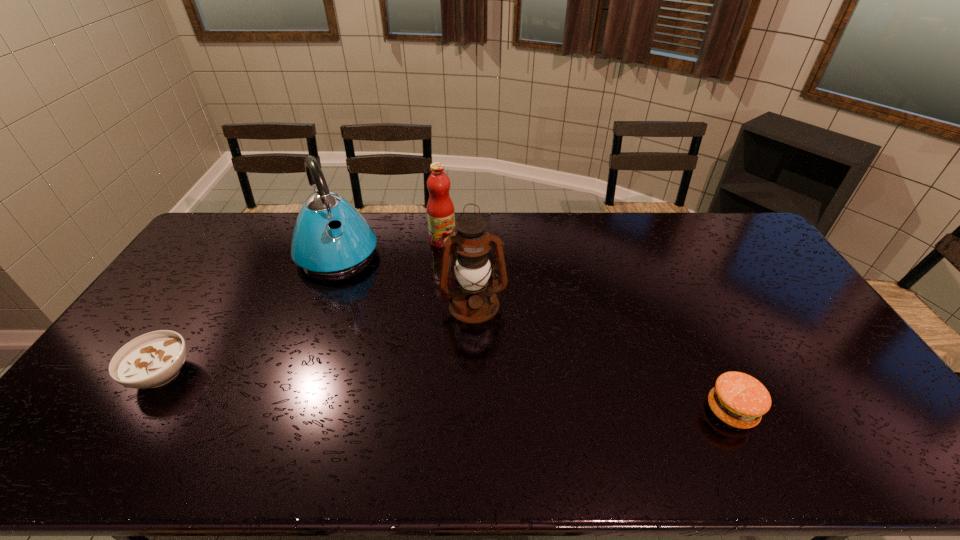
Image resolution: width=960 pixels, height=540 pixels. Find the location of `the second closest object to the third farthest object`. the second closest object to the third farthest object is located at coordinates (348, 244).

Where is `vacant space that satisfies the following two spatial constraints: 1. on the back side of the shortest object; 2. on the left side of the third farthest object`? vacant space that satisfies the following two spatial constraints: 1. on the back side of the shortest object; 2. on the left side of the third farthest object is located at coordinates (206, 305).